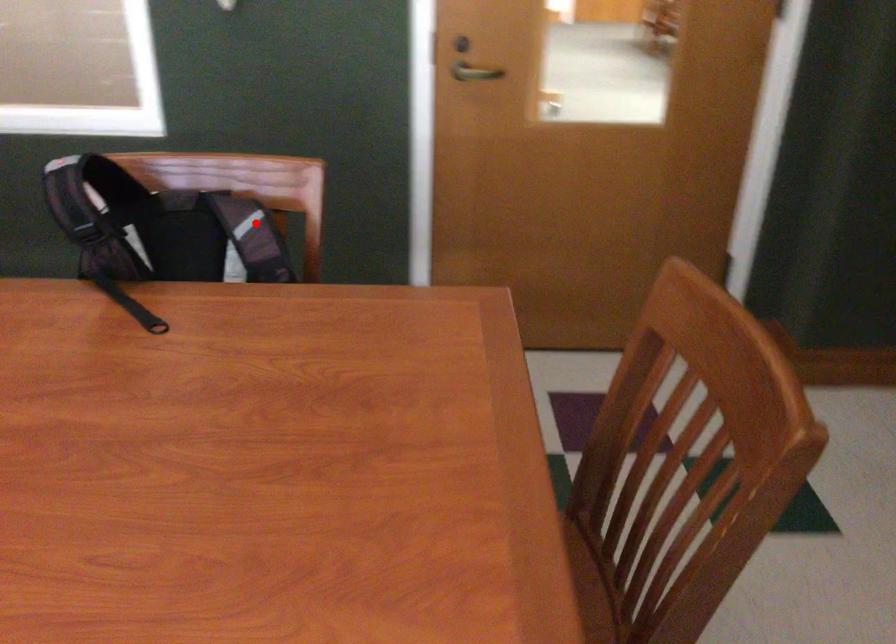
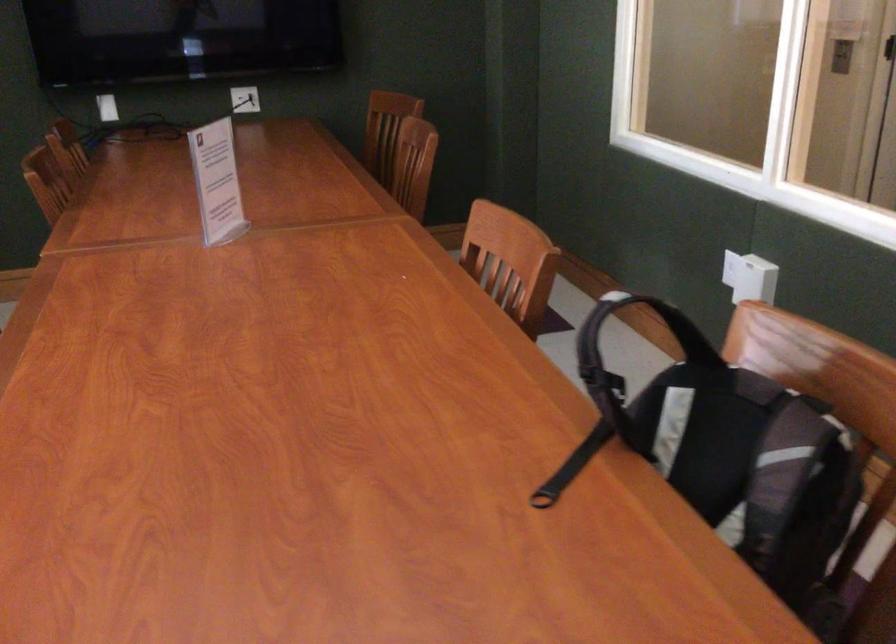
Find the pixel in the second image that matches the highlighted location in the first image.

(796, 456)